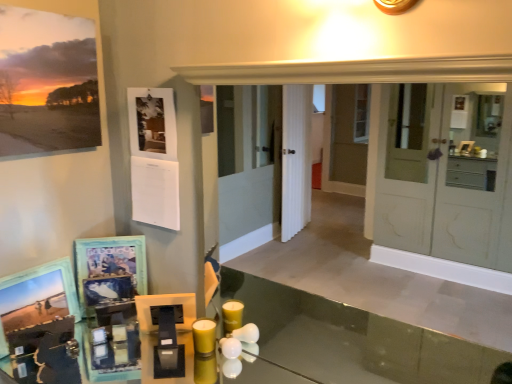
Question: Is wooden photo frame at lower left, which is counted as the third picture frame, starting from the top, taller or shorter than wooden picture frame at lower left, which is counted as the 2th picture frame, starting from the bottom?

Choices:
 (A) short
 (B) tall

Answer: (A)

Question: Considering the positions of point (47, 269) and point (139, 284), is point (47, 269) closer or farther from the camera than point (139, 284)?

Choices:
 (A) closer
 (B) farther

Answer: (A)

Question: Which is nearer to the wooden photo frame at lower left, the first picture frame ordered from the bottom?

Choices:
 (A) yellow matte candle at lower center
 (B) matte paper print at upper left, the 3th picture frame when ordered from bottom to top
 (C) wooden picture frame at lower left, which appears as the 2th picture frame when viewed from the top

Answer: (C)

Question: Based on their relative distances, which object is farther from the yellow matte candle at lower center?

Choices:
 (A) wooden picture frame at lower left, which is counted as the 2th picture frame, starting from the bottom
 (B) matte paper print at upper left, the 1th picture frame positioned from the top
 (C) wooden photo frame at lower left, which is counted as the third picture frame, starting from the top

Answer: (B)